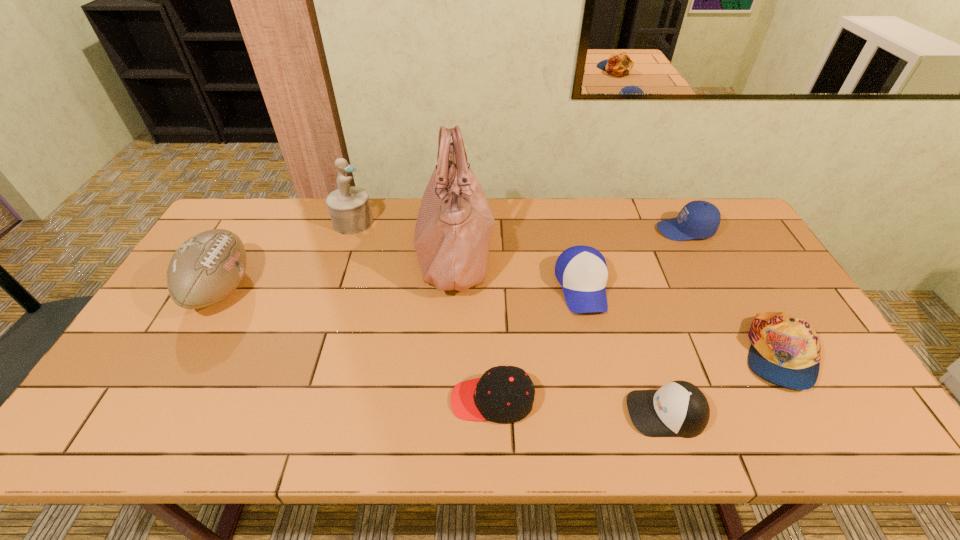
Identify the location of cap identified as the closest to the farthest cap. (785, 350).

Locate an element on the screen. The height and width of the screenshot is (540, 960). vacant point that satisfies the following two spatial constraints: 1. on the front-facing side of the farthest cap; 2. on the front-facing side of the baseball cap is located at coordinates [x=715, y=287].

Locate an element on the screen. This screenshot has height=540, width=960. free location that satisfies the following two spatial constraints: 1. on the front-facing side of the baseball cap; 2. on the laces of the sixth shortest object is located at coordinates (583, 289).

Where is `blank space that satisfies the following two spatial constraints: 1. on the front-facing side of the baseball cap; 2. on the front-facing side of the leftmost cap`? This screenshot has height=540, width=960. blank space that satisfies the following two spatial constraints: 1. on the front-facing side of the baseball cap; 2. on the front-facing side of the leftmost cap is located at coordinates (608, 400).